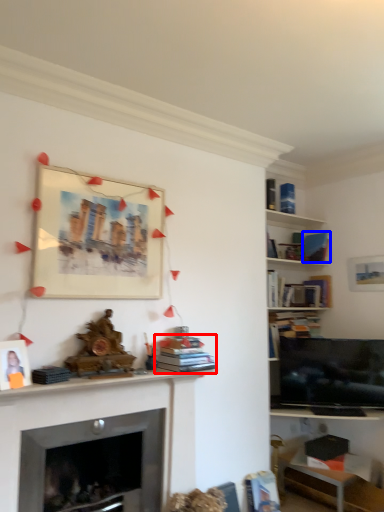
Question: Which point is closer to the camera, book (highlighted by a red box) or book (highlighted by a blue box)?

Choices:
 (A) book
 (B) book

Answer: (A)